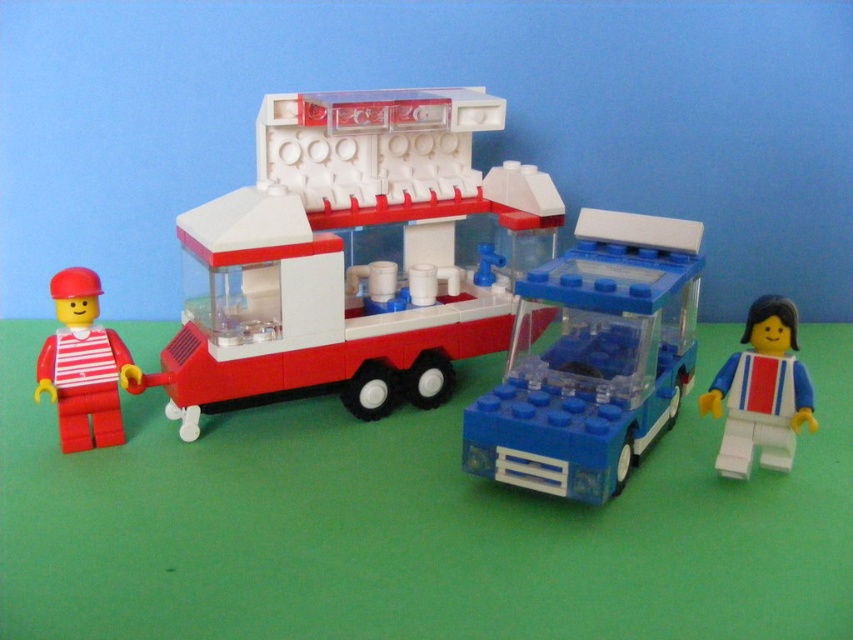
Please describe the location of the point labeled as point (355,256) in the LEGO scene.

The point labeled as point (355,256) corresponds to the matte plastic food truck at center.

You are a small LEGO figure trying to reach the transparent plastic bus at center from the matte red minifigure at left. Can you climb up to the bus directly from your current position?

The transparent plastic bus at center is located above the matte red minifigure at left, so yes, you can climb up to the transparent plastic bus at center from the matte red minifigure at left since it is positioned above you.

You are trying to decide whether to place a small LEGO plant between the matte plastic food truck at center and the matte red minifigure at left. The plant is 2 inches tall. Can the plant fit vertically between them without touching either?

The matte plastic food truck at center is taller than the matte red minifigure at left. Since the plant is only 2 inches tall, it can fit vertically between them as long as the vertical space between the two objects is at least 2 inches. However, the exact height difference between the truck and the minifigure isn